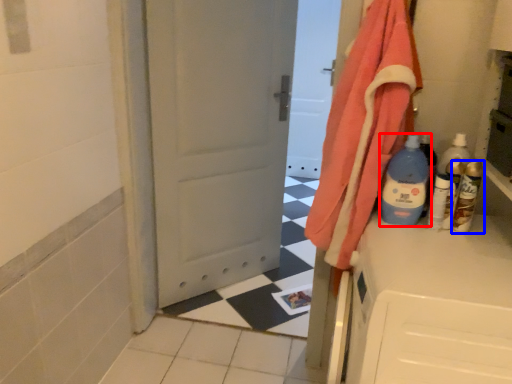
Question: Which of the following is the closest to the observer, bottle (highlighted by a red box) or bottle (highlighted by a blue box)?

Choices:
 (A) bottle
 (B) bottle

Answer: (A)